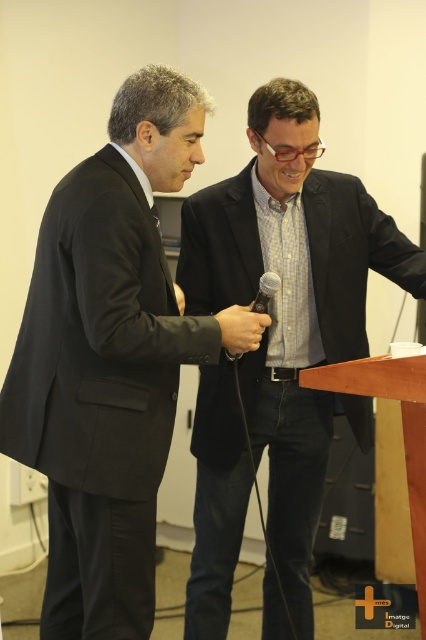
Does matte black suit at center appear on the left side of black matte microphone at center?

Incorrect, matte black suit at center is not on the left side of black matte microphone at center.

Does matte black suit at center have a lesser width compared to black matte microphone at center?

No.

Between point (253, 448) and point (253, 317), which one is positioned behind?

Positioned behind is point (253, 448).

Image resolution: width=426 pixels, height=640 pixels. In order to click on matte black suit at center in this screenshot , I will do `click(293, 305)`.

Is matte black suit at left to the right of black matte microphone at center from the viewer's perspective?

No, matte black suit at left is not to the right of black matte microphone at center.

Where is `matte black suit at left`? This screenshot has width=426, height=640. matte black suit at left is located at coordinates 108,360.

Where is `matte black suit at left`? matte black suit at left is located at coordinates (108, 360).

Does black matte microphone at center appear under matte black microphone at center?

Yes.

How distant is black matte microphone at center from matte black microphone at center?

black matte microphone at center and matte black microphone at center are 9.06 centimeters apart.

Identify the location of black matte microphone at center. (241, 328).